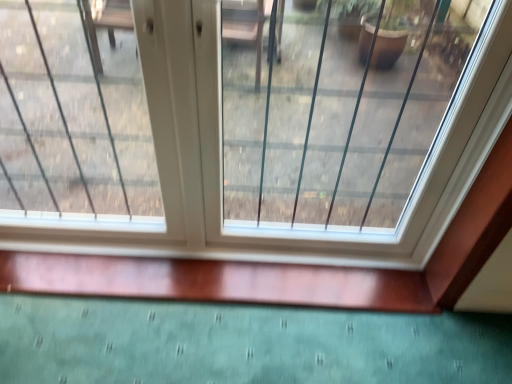
Question: Relative to transparent glass window at center, is clear glass window at center in front or behind?

Choices:
 (A) front
 (B) behind

Answer: (A)

Question: Choose the correct answer: Is clear glass window at center inside transparent glass window at center or outside it?

Choices:
 (A) outside
 (B) inside

Answer: (B)

Question: Is point 332,92 positioned closer to the camera than point 123,228?

Choices:
 (A) farther
 (B) closer

Answer: (A)

Question: Based on their positions, is transparent glass window at center located to the left or right of clear glass window at center?

Choices:
 (A) right
 (B) left

Answer: (B)

Question: Is transparent glass window at center wider or thinner than clear glass window at center?

Choices:
 (A) thin
 (B) wide

Answer: (A)

Question: Which is correct: transparent glass window at center is inside clear glass window at center, or outside of it?

Choices:
 (A) outside
 (B) inside

Answer: (B)

Question: Considering the positions of point (459, 183) and point (339, 36), is point (459, 183) closer or farther from the camera than point (339, 36)?

Choices:
 (A) closer
 (B) farther

Answer: (A)